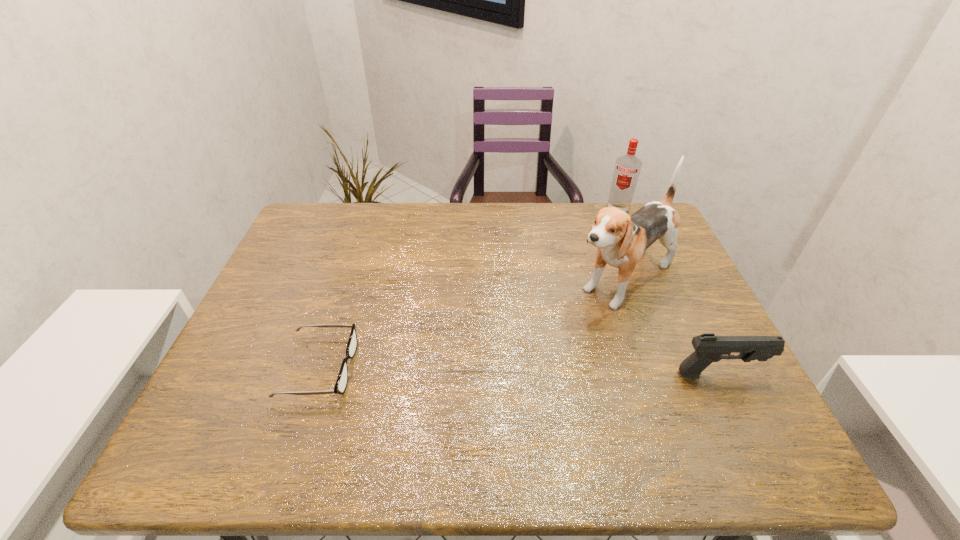
Find the location of `spectacles`. spectacles is located at coordinates 342,380.

This screenshot has height=540, width=960. Identify the location of the shortest object. (342, 380).

Where is `pistol`? The height and width of the screenshot is (540, 960). pistol is located at coordinates (709, 348).

I want to click on the third shortest object, so click(x=627, y=168).

Where is `the farthest object`? The image size is (960, 540). the farthest object is located at coordinates (627, 168).

I want to click on puppy, so click(x=621, y=239).

Identify the location of the tallest object. This screenshot has width=960, height=540. (621, 239).

Find the location of a particular element. vacant point located 0.070m on the front-facing side of the shortest object is located at coordinates (384, 368).

Where is `vacant space located on the front label of the second tallest object`? The image size is (960, 540). vacant space located on the front label of the second tallest object is located at coordinates pyautogui.click(x=608, y=235).

At what (x,y) coordinates should I click in order to perform the action: click on vacant space located 0.090m on the front label of the second tallest object. Please return your answer as a coordinate pair (x, y). The width and height of the screenshot is (960, 540). Looking at the image, I should click on (609, 232).